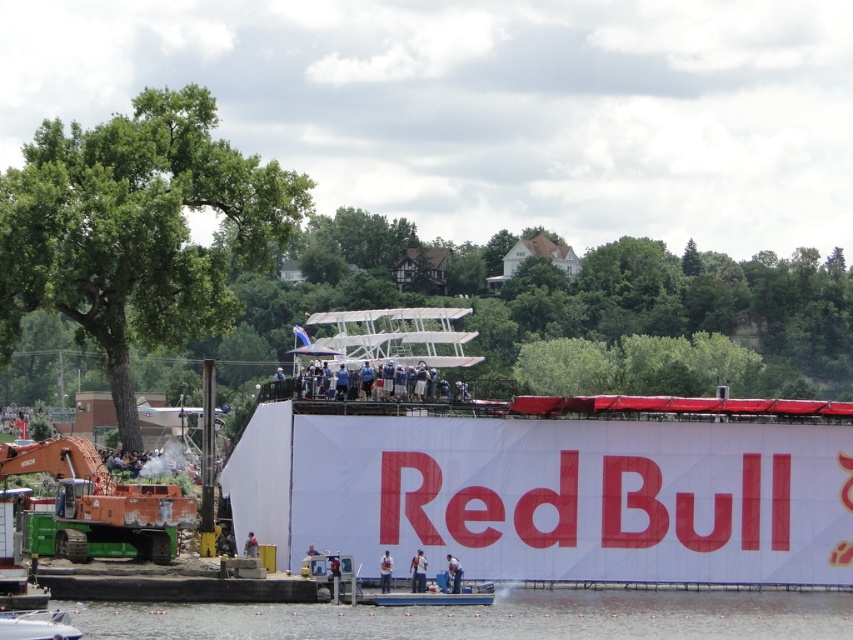
Looking at this image, which is above, blue fabric crowd at center or white fabric person at lower center?

blue fabric crowd at center

Is blue fabric crowd at center bigger than white fabric person at lower center?

Actually, blue fabric crowd at center might be smaller than white fabric person at lower center.

Consider the image. Measure the distance between point (349, 378) and camera.

A distance of 252.95 feet exists between point (349, 378) and camera.

At what (x,y) coordinates should I click in order to perform the action: click on blue fabric crowd at center. Please return your answer as a coordinate pair (x, y). Looking at the image, I should click on (376, 378).

I want to click on blue fabric crowd at center, so click(376, 378).

Between point (387, 394) and point (248, 556), which one is positioned in front?

Point (248, 556) is more forward.

The image size is (853, 640). What do you see at coordinates (376, 378) in the screenshot?
I see `blue fabric crowd at center` at bounding box center [376, 378].

This screenshot has height=640, width=853. In order to click on blue fabric crowd at center in this screenshot , I will do `click(376, 378)`.

Does light blue jeans at lower center appear over blue fabric shirt at center?

Actually, light blue jeans at lower center is below blue fabric shirt at center.

Who is more forward, (412, 586) or (250, 547)?

Positioned in front is point (412, 586).

Find the location of a particular element. This screenshot has width=853, height=640. light blue jeans at lower center is located at coordinates (418, 572).

Image resolution: width=853 pixels, height=640 pixels. What are the coordinates of `light blue jeans at lower center` in the screenshot? It's located at (418, 572).